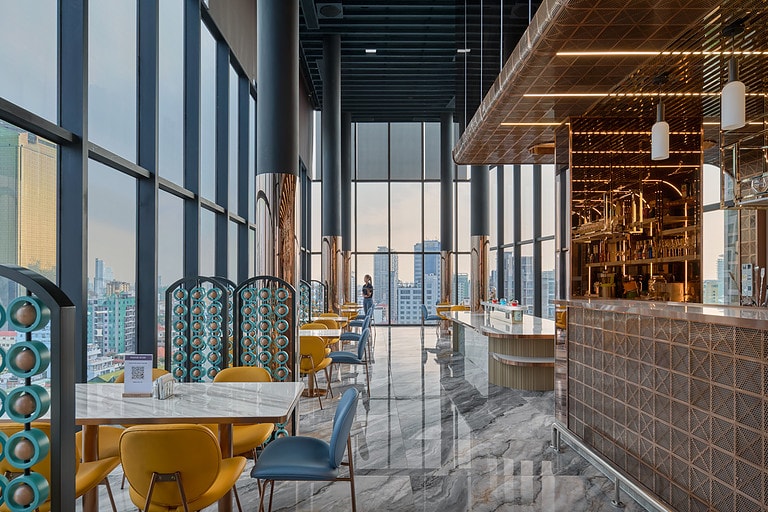
Find the location of `blue chairs`. blue chairs is located at coordinates (346, 421), (362, 341), (366, 321), (369, 310), (372, 302).